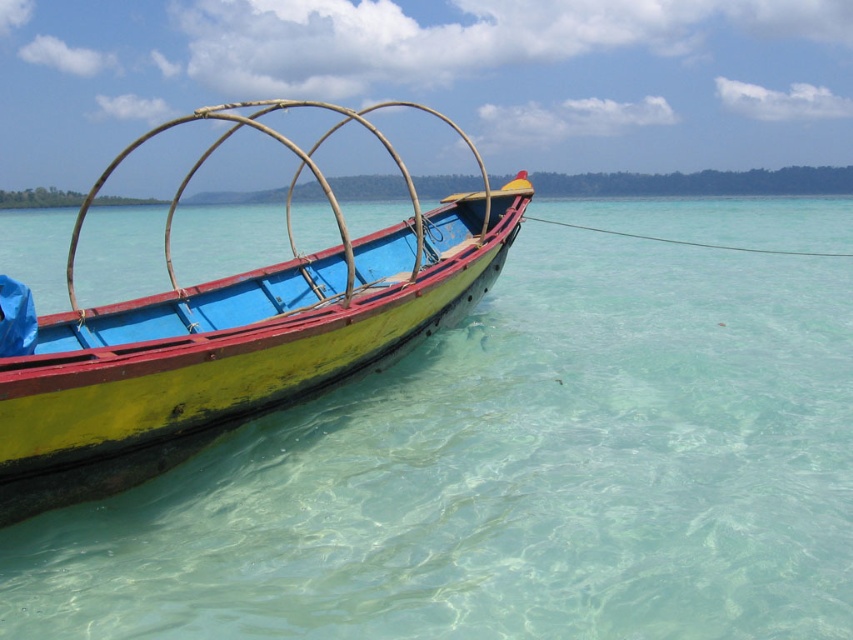
Question: From the image, what is the correct spatial relationship of clear water at boat left in relation to yellow matte boat at center?

Choices:
 (A) above
 (B) below

Answer: (B)

Question: Which point is closer to the camera?

Choices:
 (A) (415, 266)
 (B) (354, 224)

Answer: (A)

Question: Which object is farther from the camera taking this photo?

Choices:
 (A) yellow matte boat at center
 (B) clear water at boat left

Answer: (A)

Question: Does clear water at boat left have a smaller size compared to yellow matte boat at center?

Choices:
 (A) yes
 (B) no

Answer: (A)

Question: Is clear water at boat left below yellow matte boat at center?

Choices:
 (A) yes
 (B) no

Answer: (A)